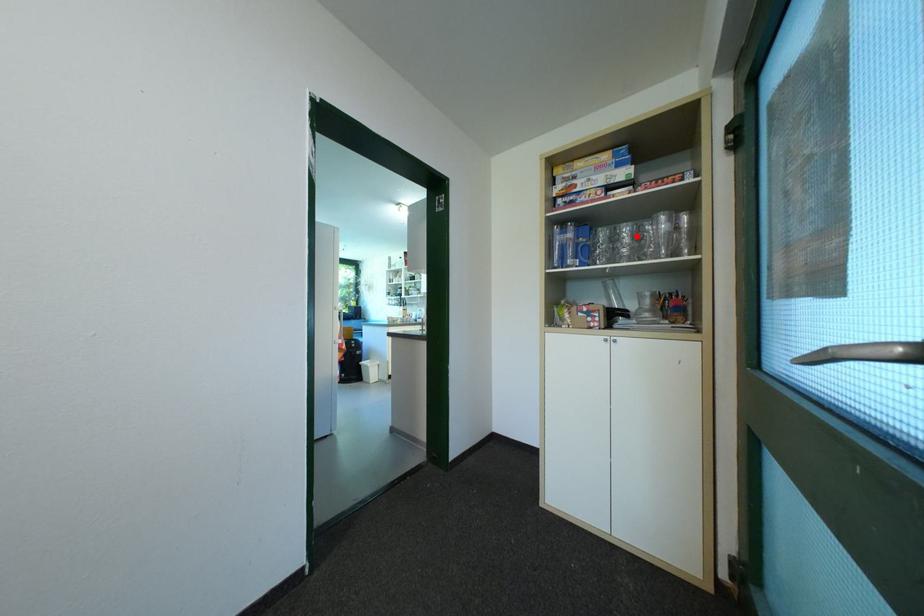
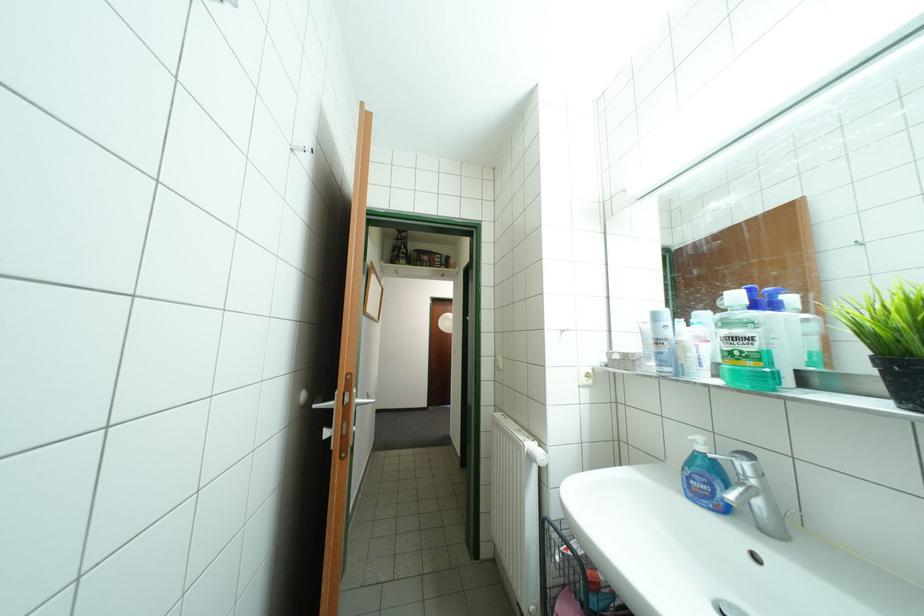
Question: I am providing you with two images of the same scene from different viewpoints. A red point is marked on the first image. At the location where the point appears in image 1, is it still visible in image 2?

Choices:
 (A) Yes
 (B) No

Answer: (B)